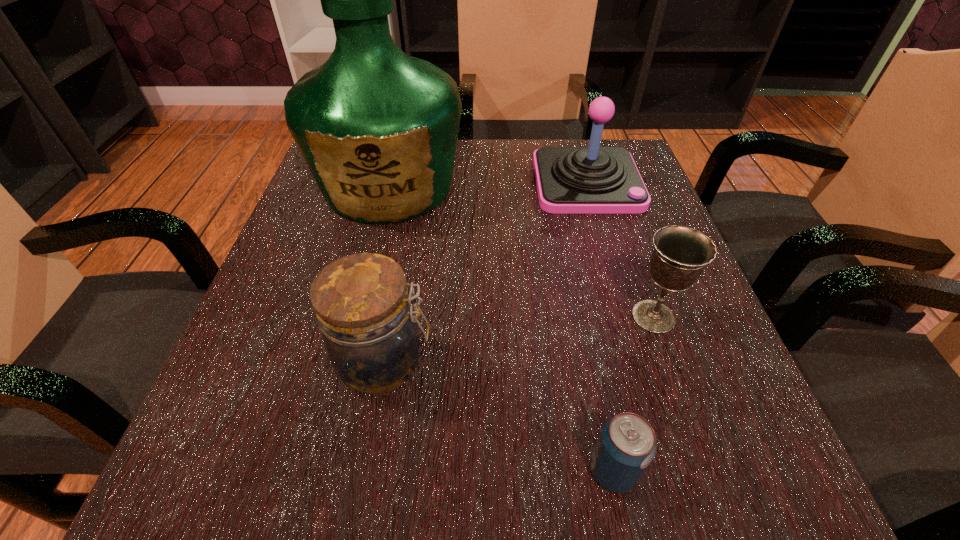
Identify the location of vacant area located 0.090m on the back of the shortest object. The height and width of the screenshot is (540, 960). (595, 386).

Identify the location of liquor positioned at the far edge. This screenshot has width=960, height=540. (378, 129).

Where is `joystick at the far edge`? Image resolution: width=960 pixels, height=540 pixels. joystick at the far edge is located at coordinates (570, 180).

Locate an element on the screen. Image resolution: width=960 pixels, height=540 pixels. object that is positioned at the near edge is located at coordinates (627, 444).

Locate an element on the screen. The height and width of the screenshot is (540, 960). liquor at the left edge is located at coordinates (378, 129).

The width and height of the screenshot is (960, 540). Find the location of `jar that is at the left edge`. jar that is at the left edge is located at coordinates (362, 304).

The width and height of the screenshot is (960, 540). What are the coordinates of `joystick positioned at the right edge` in the screenshot? It's located at (570, 180).

Where is `chalice present at the right edge`? The image size is (960, 540). chalice present at the right edge is located at coordinates (680, 253).

Identify the location of object present at the far left corner. (378, 129).

What are the coordinates of `object that is positioned at the far right corner` in the screenshot? It's located at (570, 180).